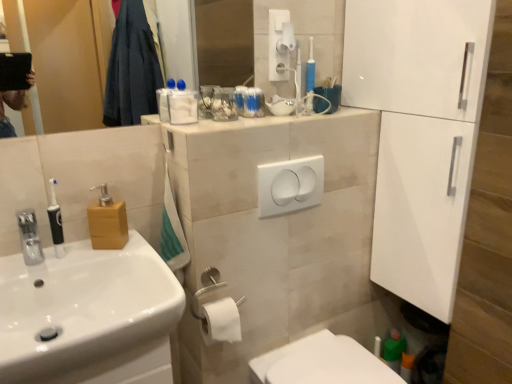
Question: Should I look upward or downward to see white matte toilet paper at lower center, the second toilet paper viewed from the right?

Choices:
 (A) down
 (B) up

Answer: (A)

Question: Does white glossy sink at left appear on the right side of white glossy toilet at lower center?

Choices:
 (A) no
 (B) yes

Answer: (A)

Question: Are white glossy sink at left and white glossy toilet at lower center located far from each other?

Choices:
 (A) yes
 (B) no

Answer: (B)

Question: Is white glossy toilet at lower center located within white glossy sink at left?

Choices:
 (A) yes
 (B) no

Answer: (B)

Question: Is white glossy sink at left bigger than white glossy toilet at lower center?

Choices:
 (A) yes
 (B) no

Answer: (A)

Question: Does white glossy sink at left have a greater width compared to white glossy toilet at lower center?

Choices:
 (A) yes
 (B) no

Answer: (A)

Question: Is white glossy sink at left facing towards white glossy toilet at lower center?

Choices:
 (A) yes
 (B) no

Answer: (B)

Question: Is translucent plastic toothbrushes at upper center, arranged as the second toiletry when viewed from the left, looking in the opposite direction of black rubberized toothbrush at left, the 1th toiletry from the bottom?

Choices:
 (A) no
 (B) yes

Answer: (A)

Question: Considering the relative positions of translucent plastic toothbrushes at upper center, the 1th toiletry in the right-to-left sequence, and black rubberized toothbrush at left, the 1th toiletry from the bottom, in the image provided, is translucent plastic toothbrushes at upper center, the 1th toiletry in the right-to-left sequence, to the right of black rubberized toothbrush at left, the 1th toiletry from the bottom, from the viewer's perspective?

Choices:
 (A) no
 (B) yes

Answer: (B)

Question: Considering the relative positions of translucent plastic toothbrushes at upper center, which is the 2th toiletry from front to back, and black rubberized toothbrush at left, which is counted as the 2th toiletry, starting from the right, in the image provided, is translucent plastic toothbrushes at upper center, which is the 2th toiletry from front to back, behind black rubberized toothbrush at left, which is counted as the 2th toiletry, starting from the right,?

Choices:
 (A) no
 (B) yes

Answer: (B)

Question: Is translucent plastic toothbrushes at upper center, arranged as the second toiletry when viewed from the left, at the left side of black rubberized toothbrush at left, which is counted as the 2th toiletry, starting from the right?

Choices:
 (A) no
 (B) yes

Answer: (A)

Question: Can you confirm if translucent plastic toothbrushes at upper center, the 1th toiletry in the right-to-left sequence, is smaller than black rubberized toothbrush at left, arranged as the first toiletry when viewed from the left?

Choices:
 (A) no
 (B) yes

Answer: (A)

Question: Is translucent plastic toothbrushes at upper center, the 1th toiletry in the right-to-left sequence, outside black rubberized toothbrush at left, arranged as the first toiletry when viewed from the left?

Choices:
 (A) no
 (B) yes

Answer: (B)

Question: From a real-world perspective, is white plastic hand dryer at upper center positioned over black rubberized toothbrush at left, which appears as the second toiletry when viewed from the back, based on gravity?

Choices:
 (A) yes
 (B) no

Answer: (A)